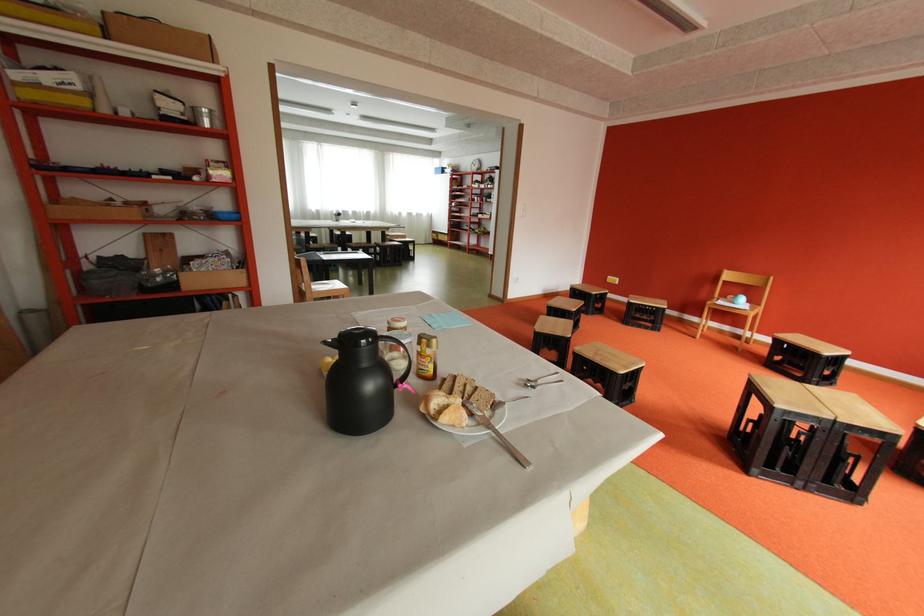
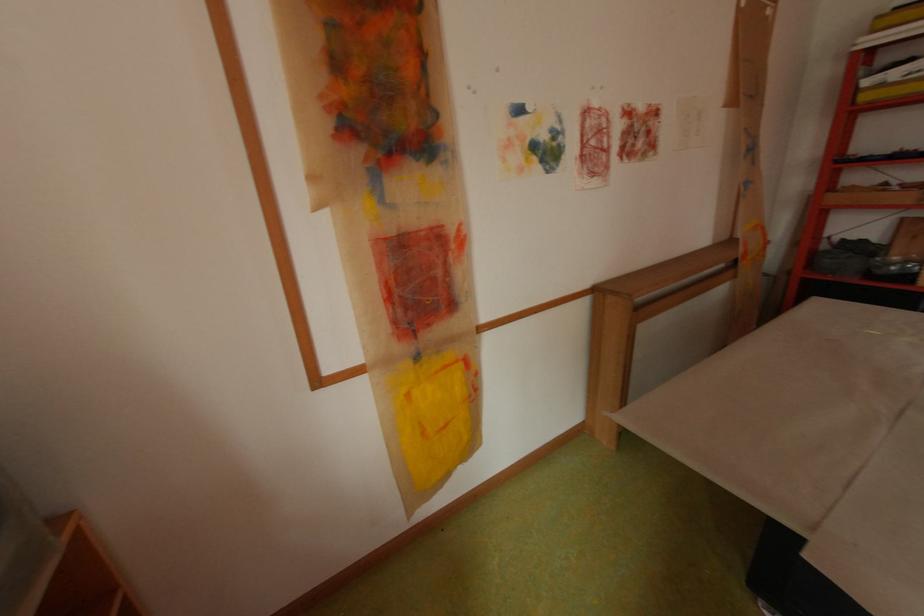
From the picture: Based on the continuous images, in which direction is the camera rotating?

The camera's rotation is toward left-down.